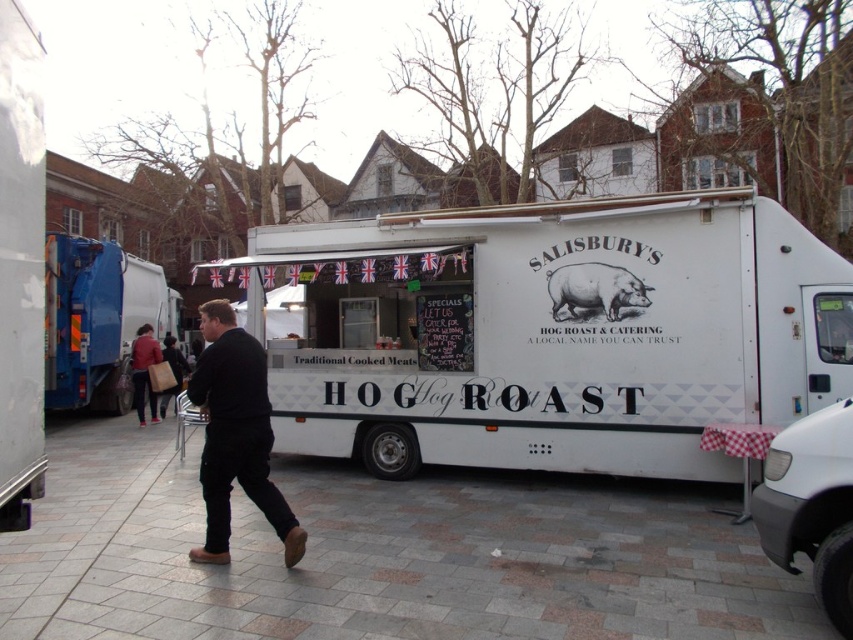
Who is shorter, white matte food truck at center or gray concrete pavement at lower center?

gray concrete pavement at lower center is shorter.

Which is in front, point (828, 323) or point (273, 618)?

Point (273, 618)

The width and height of the screenshot is (853, 640). I want to click on white matte food truck at center, so click(548, 333).

Is blue metallic garbage truck at left above matte white pig at center?

Actually, blue metallic garbage truck at left is below matte white pig at center.

Does blue metallic garbage truck at left appear on the right side of matte white pig at center?

In fact, blue metallic garbage truck at left is to the left of matte white pig at center.

Which is in front, point (56, 266) or point (599, 284)?

Point (599, 284)

Where is `blue metallic garbage truck at left`? blue metallic garbage truck at left is located at coordinates (97, 321).

Can you confirm if matte red jacket at left is wider than dark blue jeans at center?

No.

Which is in front, point (152, 362) or point (171, 365)?

Point (152, 362)

What are the coordinates of `matte red jacket at left` in the screenshot? It's located at (144, 371).